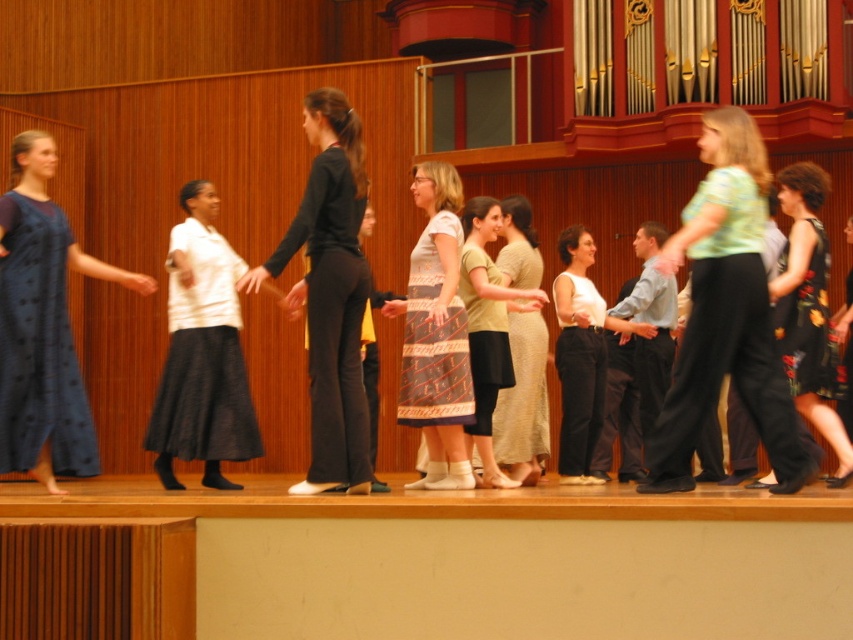
Question: Can you confirm if dark blue dotted dress at left is wider than white cotton blouse at center?

Choices:
 (A) no
 (B) yes

Answer: (A)

Question: Is dark blue dotted dress at left above floral-patterned fabric dress at right?

Choices:
 (A) no
 (B) yes

Answer: (A)

Question: Is white cotton skirt at center to the left of white cotton blouse at center from the viewer's perspective?

Choices:
 (A) no
 (B) yes

Answer: (B)

Question: Among these points, which one is farthest from the camera?

Choices:
 (A) (801, 344)
 (B) (231, 257)
 (C) (312, 346)

Answer: (B)

Question: Which point is closer to the camera taking this photo?

Choices:
 (A) (824, 344)
 (B) (572, 456)

Answer: (A)

Question: Estimate the real-world distances between objects in this image. Which object is closer to the printed cotton dress at center?

Choices:
 (A) black smooth pants at center
 (B) floral-patterned dress at right
 (C) dark blue dotted dress at left

Answer: (A)